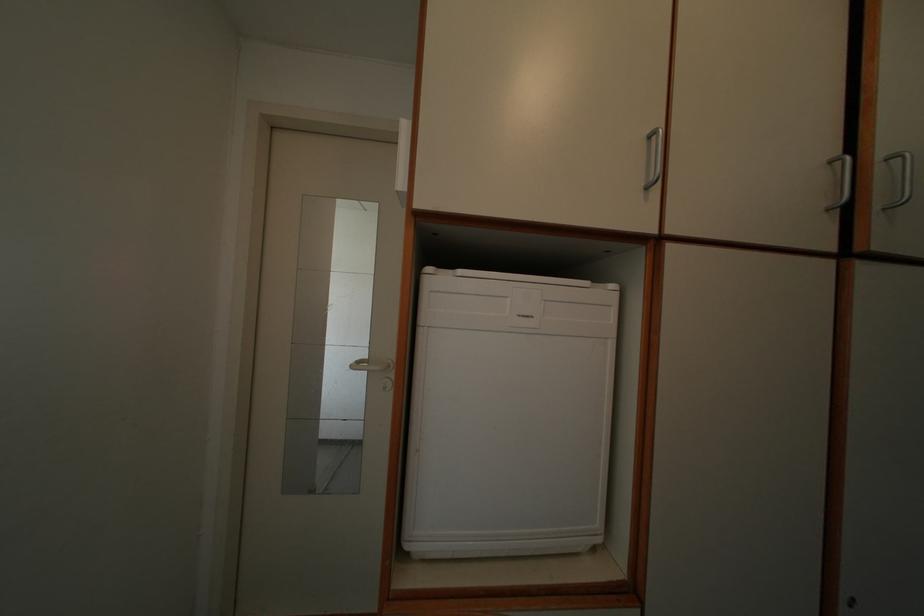
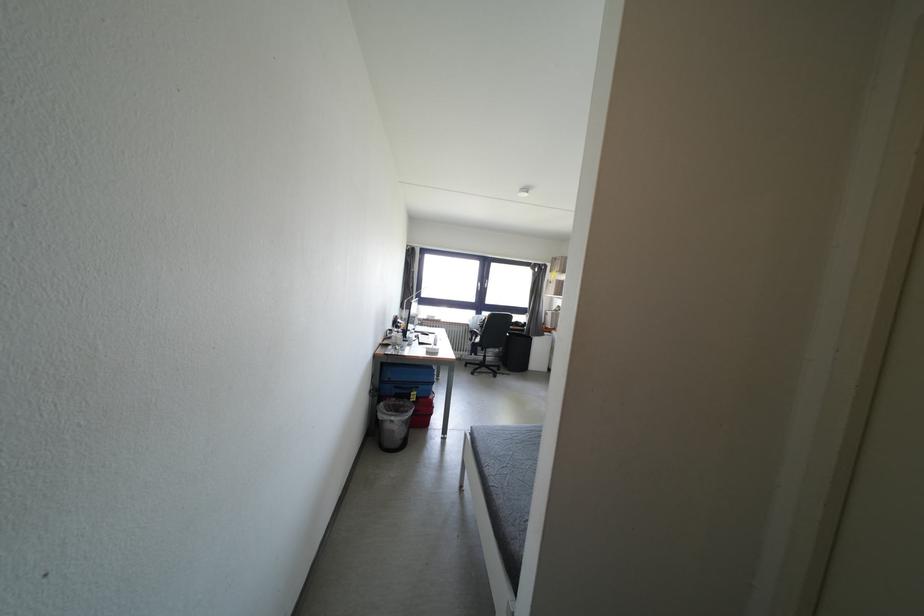
Question: Based on the continuous images, in which direction is the camera rotating? Reply with the corresponding letter.

Choices:
 (A) Left
 (B) Right
 (C) Up
 (D) Down

Answer: (A)